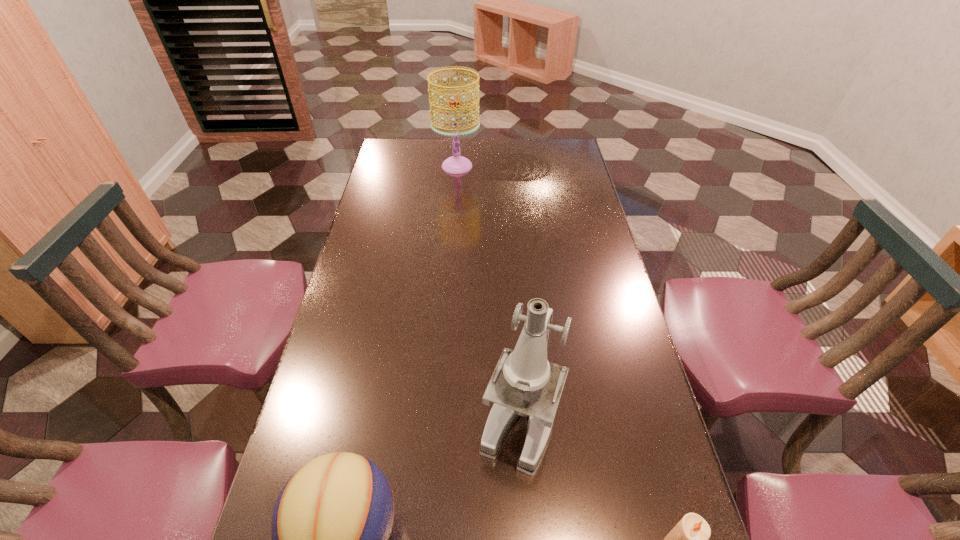
This screenshot has width=960, height=540. In order to click on vacant region between the microscope and the farthest object in this screenshot , I will do `click(489, 293)`.

Where is `vacant space that is in between the lampshade and the microscope`? vacant space that is in between the lampshade and the microscope is located at coordinates (489, 293).

Find the location of a particular element. vacant point located between the microscope and the farthest object is located at coordinates pyautogui.click(x=489, y=293).

Point out which object is positioned as the second nearest to the third nearest object. Please provide its 2D coordinates. Your answer should be formatted as a tuple, i.e. [(x, y)], where the tuple contains the x and y coordinates of a point satisfying the conditions above.

[(689, 539)]

Point out which object is positioned as the third nearest to the third nearest object. Please provide its 2D coordinates. Your answer should be formatted as a tuple, i.e. [(x, y)], where the tuple contains the x and y coordinates of a point satisfying the conditions above.

[(457, 164)]